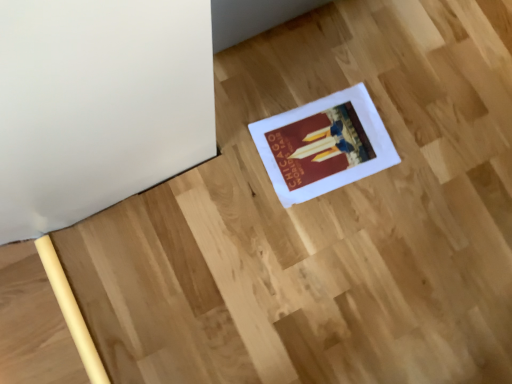
The width and height of the screenshot is (512, 384). Identify the location of free spot to the left of white matte picture frame at center. (243, 112).